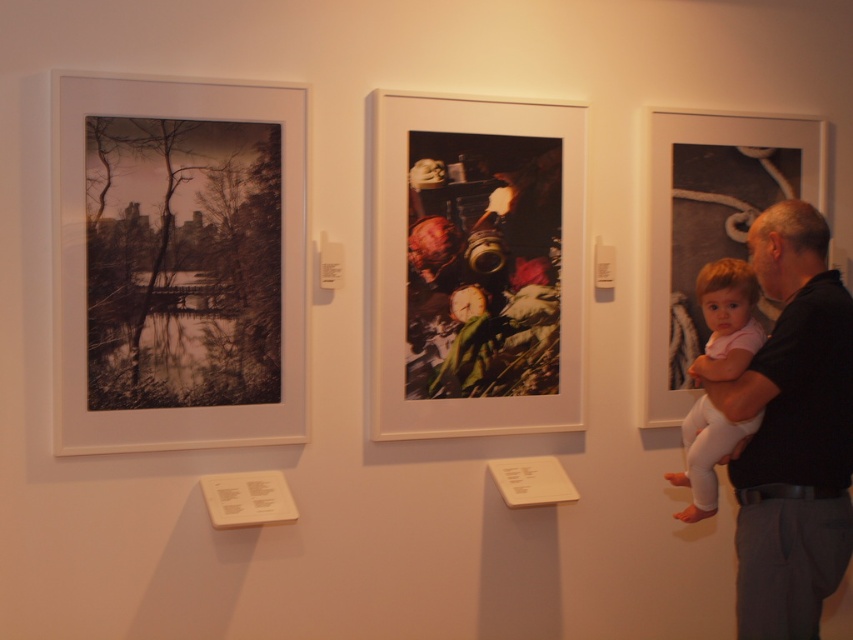
Question: Does sepia-toned paper print at left appear on the right side of metallic textured photograph at center?

Choices:
 (A) yes
 (B) no

Answer: (B)

Question: Which point is farther from the camera taking this photo?

Choices:
 (A) (567, 131)
 (B) (705, 499)
 (C) (227, 376)
 (D) (836, 566)

Answer: (A)

Question: In this image, where is black smooth shirt at right located relative to light pink fabric baby at right?

Choices:
 (A) left
 (B) right

Answer: (B)

Question: Which object appears farthest from the camera in this image?

Choices:
 (A) black smooth shirt at right
 (B) metallic textured photograph at center
 (C) sepia-toned paper print at left

Answer: (B)

Question: Which point is closer to the camera?

Choices:
 (A) matte black frame at right
 (B) metallic textured photograph at center
 (C) black smooth shirt at right

Answer: (C)

Question: Considering the relative positions of metallic textured photograph at center and light pink fabric baby at right in the image provided, where is metallic textured photograph at center located with respect to light pink fabric baby at right?

Choices:
 (A) below
 (B) above

Answer: (B)